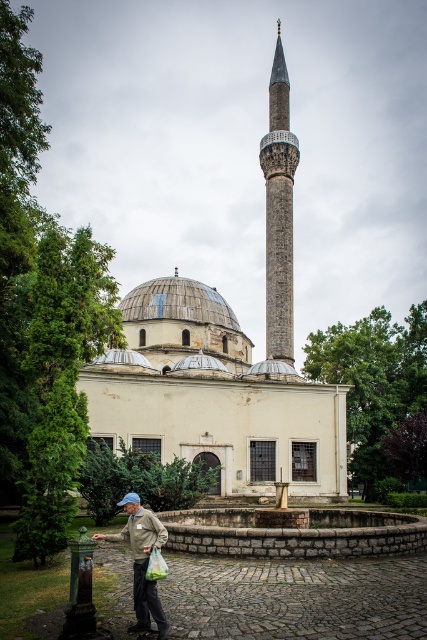
Is gray stone minaret at center thinner than light brown fabric jacket at lower left?

Indeed, gray stone minaret at center has a lesser width compared to light brown fabric jacket at lower left.

Is gray stone minaret at center smaller than light brown fabric jacket at lower left?

Actually, gray stone minaret at center might be larger than light brown fabric jacket at lower left.

Image resolution: width=427 pixels, height=640 pixels. Find the location of `gray stone minaret at center`. gray stone minaret at center is located at coordinates (278, 211).